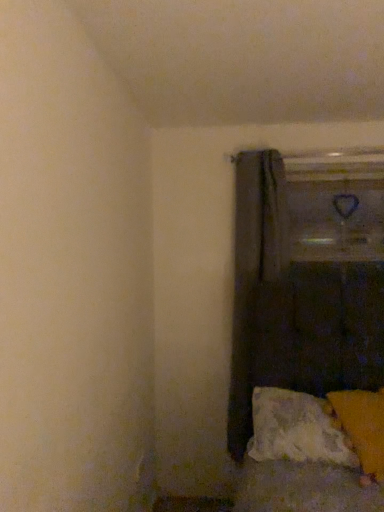
Question: Is textured white pillow at lower right, the first pillow positioned from the left, completely or partially inside dark gray fabric curtain at center?

Choices:
 (A) yes
 (B) no

Answer: (B)

Question: Can you confirm if dark gray fabric curtain at center is wider than textured white pillow at lower right, the first pillow positioned from the left?

Choices:
 (A) no
 (B) yes

Answer: (A)

Question: From a real-world perspective, is dark gray fabric curtain at center located higher than textured white pillow at lower right, the first pillow positioned from the left?

Choices:
 (A) no
 (B) yes

Answer: (B)

Question: Can you confirm if dark gray fabric curtain at center is thinner than textured white pillow at lower right, which ranks as the second pillow in right-to-left order?

Choices:
 (A) yes
 (B) no

Answer: (A)

Question: Is dark gray fabric curtain at center positioned behind textured white pillow at lower right, which ranks as the second pillow in right-to-left order?

Choices:
 (A) yes
 (B) no

Answer: (A)

Question: From the image's perspective, relative to orange fabric pillow at lower right, which appears as the first pillow when viewed from the right, is textured white pillow at lower right, which ranks as the second pillow in right-to-left order, above or below?

Choices:
 (A) below
 (B) above

Answer: (A)

Question: Is textured white pillow at lower right, the first pillow positioned from the left, wider or thinner than orange fabric pillow at lower right, which appears as the first pillow when viewed from the right?

Choices:
 (A) wide
 (B) thin

Answer: (B)

Question: Considering their positions, is textured white pillow at lower right, the first pillow positioned from the left, located in front of or behind orange fabric pillow at lower right, which appears as the first pillow when viewed from the right?

Choices:
 (A) behind
 (B) front

Answer: (A)

Question: Would you say textured white pillow at lower right, which ranks as the second pillow in right-to-left order, is inside or outside orange fabric pillow at lower right, acting as the 2th pillow starting from the left?

Choices:
 (A) inside
 (B) outside

Answer: (A)

Question: Choose the correct answer: Is dark gray fabric curtain at center inside orange fabric pillow at lower right, which appears as the first pillow when viewed from the right, or outside it?

Choices:
 (A) inside
 (B) outside

Answer: (B)

Question: Is dark gray fabric curtain at center taller or shorter than orange fabric pillow at lower right, acting as the 2th pillow starting from the left?

Choices:
 (A) tall
 (B) short

Answer: (A)

Question: Is dark gray fabric curtain at center wider or thinner than orange fabric pillow at lower right, acting as the 2th pillow starting from the left?

Choices:
 (A) wide
 (B) thin

Answer: (B)

Question: Would you say dark gray fabric curtain at center is to the left or to the right of orange fabric pillow at lower right, acting as the 2th pillow starting from the left, in the picture?

Choices:
 (A) left
 (B) right

Answer: (A)

Question: Choose the correct answer: Is orange fabric pillow at lower right, which appears as the first pillow when viewed from the right, inside dark gray fabric curtain at center or outside it?

Choices:
 (A) inside
 (B) outside

Answer: (B)

Question: Considering the positions of orange fabric pillow at lower right, acting as the 2th pillow starting from the left, and dark gray fabric curtain at center in the image, is orange fabric pillow at lower right, acting as the 2th pillow starting from the left, taller or shorter than dark gray fabric curtain at center?

Choices:
 (A) short
 (B) tall

Answer: (A)